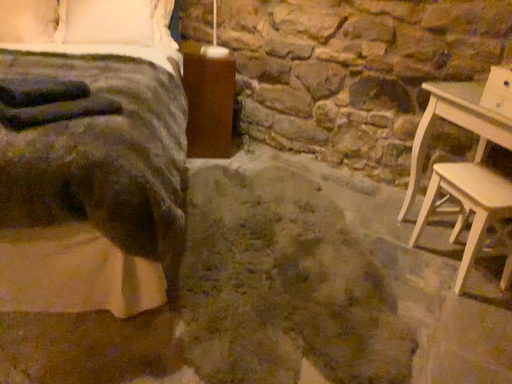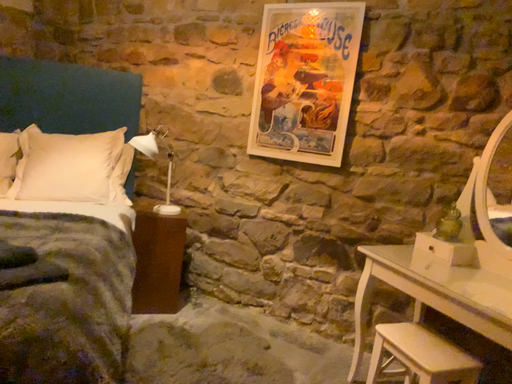
Question: How did the camera likely rotate when shooting the video?

Choices:
 (A) rotated left
 (B) rotated right

Answer: (B)